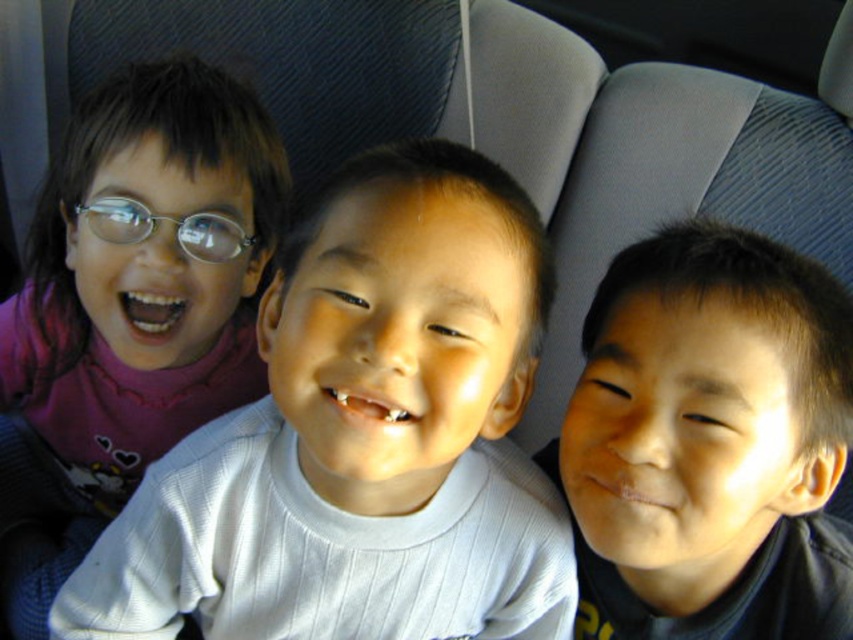
You are a photographer adjusting the focus of your camera. You want to ensure both the smooth skin face at center and the metallic silver glasses at left are in focus. Given that the depth of field can only accommodate one object clearly, which object should you focus on to capture the most detail?

The smooth skin face at center has a larger size compared to metallic silver glasses at left, so focusing on the smooth skin face at center would capture more detail.

You are a photographer trying to capture the children in the car. You need to focus on the pink fabric shirt at left. Where exactly should you point your camera to capture it?

You should point your camera to point (x=360, y=436) to capture the pink fabric shirt at left.

You are a photographer trying to adjust the lighting for a group photo. You notice two elements in the scene that might affect the lighting balance. The smooth skin face at center and the purple fleece shirt at left. Which of these two elements is positioned lower in the frame?

The smooth skin face at center has a lesser height compared to the purple fleece shirt at left, so it is positioned lower in the frame.